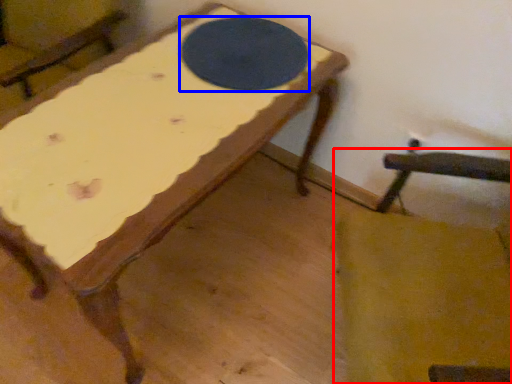
Question: Which of the following is the farthest to the observer, rocking chair (highlighted by a red box) or table tennis table (highlighted by a blue box)?

Choices:
 (A) rocking chair
 (B) table tennis table

Answer: (B)